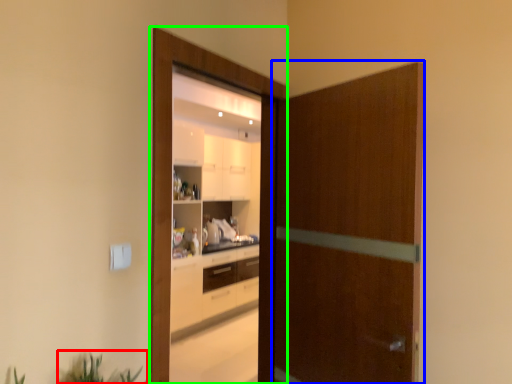
Question: Estimate the real-world distances between objects in this image. Which object is farther from plant (highlighted by a red box), screen door (highlighted by a blue box) or screen door (highlighted by a green box)?

Choices:
 (A) screen door
 (B) screen door

Answer: (A)